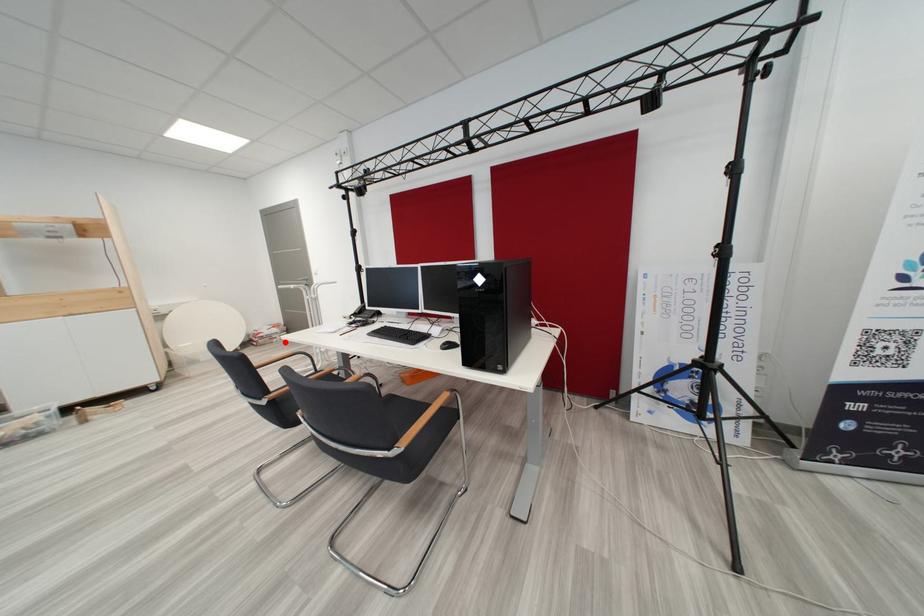
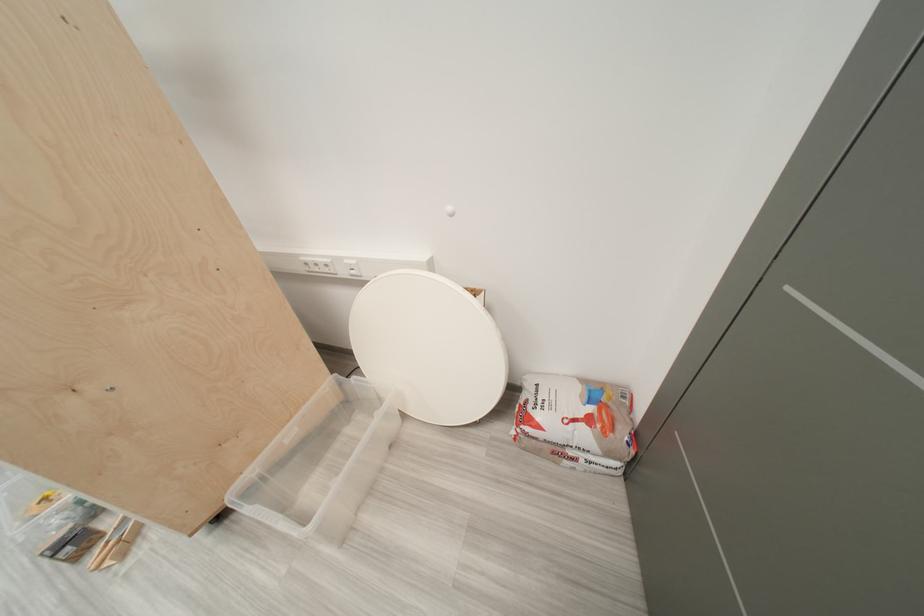
Where in the second image is the point corresponding to the highlighted location from the first image?

(577, 464)